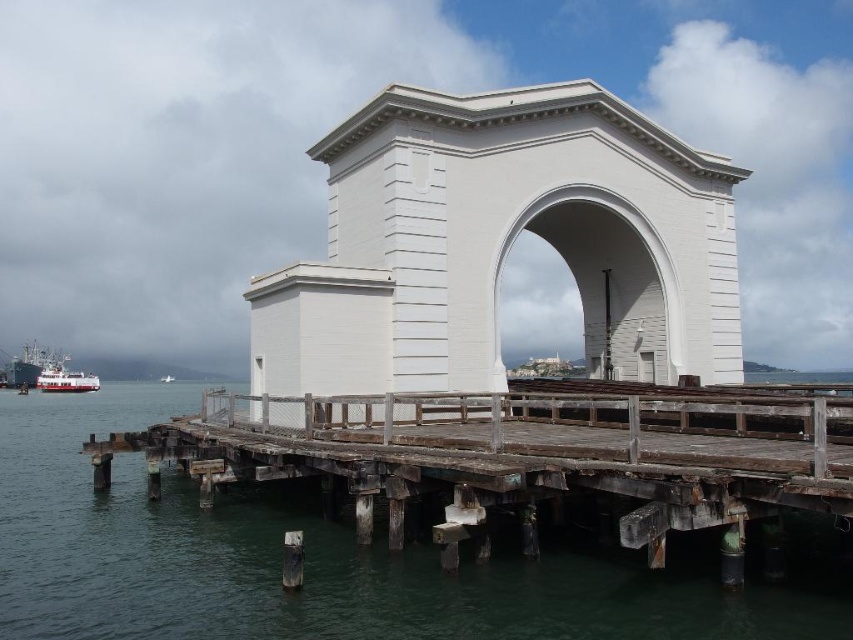
You are standing at the end of the weathered wooden pier and want to know the exact coordinates of the white matte archway at center. What are its coordinates?

The white matte archway at center is located at coordinates point (612, 280).